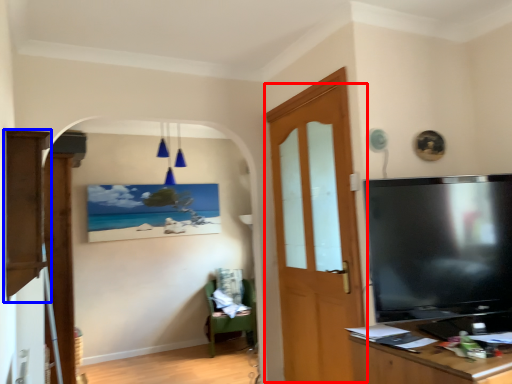
Question: Which object appears farthest to the camera in this image, door (highlighted by a red box) or cabinetry (highlighted by a blue box)?

Choices:
 (A) door
 (B) cabinetry

Answer: (A)